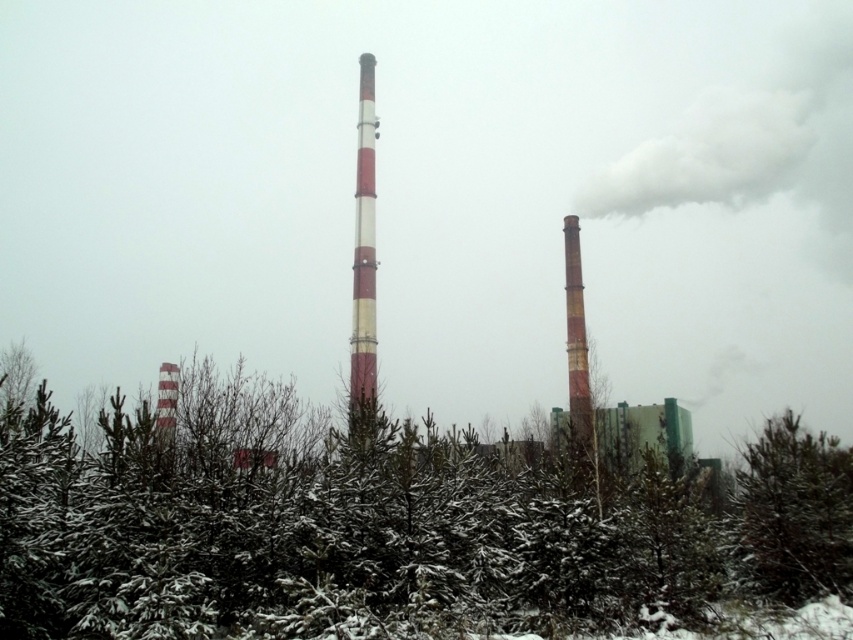
You are a surveyor measuring distances in the industrial area. You have a drone that can carry a 30 meter rope. You need to measure the distance between the green matte tree at lower right and the red and white striped pole at center. Can your rope reach between them?

The green matte tree at lower right and the red and white striped pole at center are 33.14 meters apart. Since the rope is only 30 meters long, it cannot reach between them.